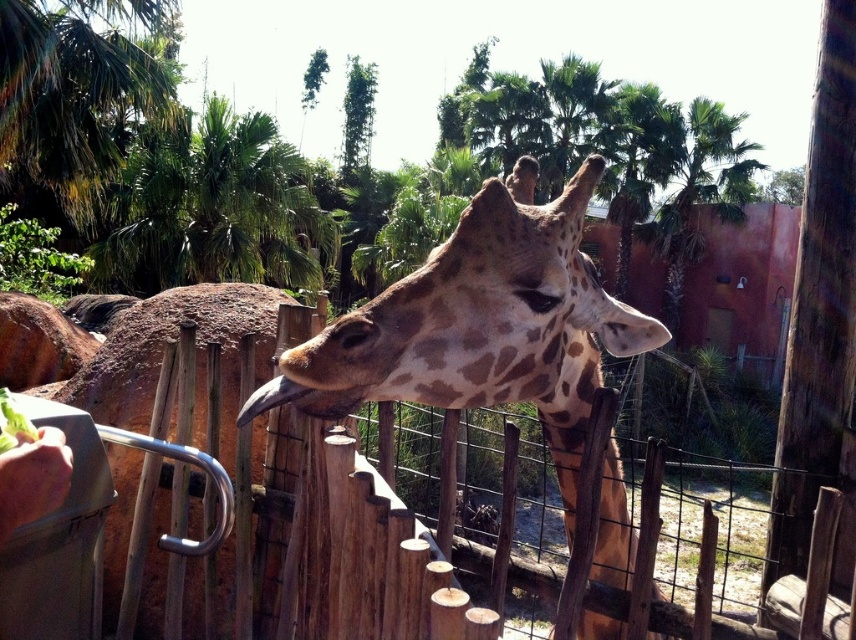
Question: Which point is farther from the camera taking this photo?

Choices:
 (A) (134, 184)
 (B) (580, 429)

Answer: (A)

Question: Which point is closer to the camera taking this photo?

Choices:
 (A) (596, 612)
 (B) (300, 186)

Answer: (A)

Question: Does green leafy palm tree at upper center have a lesser width compared to brown matte beak at center?

Choices:
 (A) no
 (B) yes

Answer: (A)

Question: Where is spotted brown giraffe at center located in relation to green leafy palm tree at upper center in the image?

Choices:
 (A) right
 (B) left

Answer: (A)

Question: Can you confirm if spotted brown giraffe at center is positioned to the left of green leafy palm tree at upper center?

Choices:
 (A) no
 (B) yes

Answer: (A)

Question: Which object is positioned farthest from the spotted brown giraffe at center?

Choices:
 (A) green leafy palm tree at upper center
 (B) brown matte beak at center

Answer: (A)